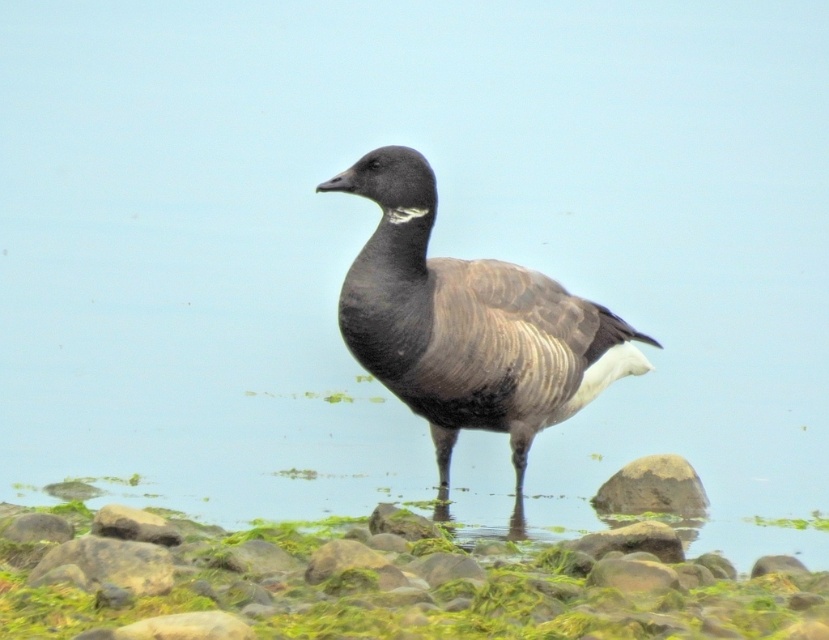
Question: Which point is farther from the camera taking this photo?

Choices:
 (A) (187, 605)
 (B) (476, 353)
 (C) (634, 492)

Answer: (C)

Question: Which point is farther to the camera?

Choices:
 (A) dark brown feathered duck at center
 (B) smooth gray rock at lower right

Answer: (B)

Question: Can you confirm if dark brown feathered duck at center is wider than smooth gray rock at lower right?

Choices:
 (A) no
 (B) yes

Answer: (B)

Question: Is green mossy rocks at lower center in front of smooth gray rock at lower right?

Choices:
 (A) yes
 (B) no

Answer: (A)

Question: Which is farther from the green mossy rocks at lower center?

Choices:
 (A) smooth gray rock at lower right
 (B) dark brown feathered duck at center

Answer: (A)

Question: Is green mossy rocks at lower center thinner than dark brown feathered duck at center?

Choices:
 (A) yes
 (B) no

Answer: (B)